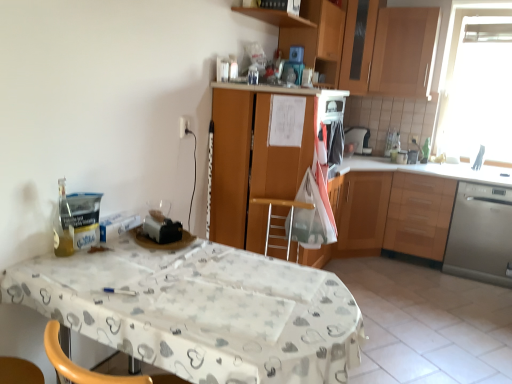
Question: Is wooden cabinet at upper right, which is the 2th cabinetry from right to left, not within wooden cabinet at right, which is the first cabinetry in right-to-left order?

Choices:
 (A) yes
 (B) no

Answer: (A)

Question: Is wooden cabinet at upper right, which is the 2th cabinetry from right to left, oriented away from wooden cabinet at right, the 4th cabinetry from the left?

Choices:
 (A) no
 (B) yes

Answer: (A)

Question: Is wooden cabinet at upper right, the 3th cabinetry positioned from the left, smaller than wooden cabinet at right, the 4th cabinetry from the left?

Choices:
 (A) no
 (B) yes

Answer: (B)

Question: Considering the relative sizes of wooden cabinet at upper right, which is the 2th cabinetry from right to left, and wooden cabinet at right, the 4th cabinetry from the left, in the image provided, is wooden cabinet at upper right, which is the 2th cabinetry from right to left, thinner than wooden cabinet at right, the 4th cabinetry from the left,?

Choices:
 (A) yes
 (B) no

Answer: (A)

Question: From a real-world perspective, is wooden cabinet at upper right, which is the 2th cabinetry from right to left, located higher than wooden cabinet at right, the 4th cabinetry from the left?

Choices:
 (A) no
 (B) yes

Answer: (B)

Question: In the image, is white fabric-covered table at center positioned in front of or behind wooden cabinet at center, which ranks as the fourth cabinetry in right-to-left order?

Choices:
 (A) behind
 (B) front

Answer: (B)

Question: From a real-world perspective, relative to wooden cabinet at center, which is counted as the first cabinetry, starting from the left, is white fabric-covered table at center vertically above or below?

Choices:
 (A) below
 (B) above

Answer: (A)

Question: Considering the positions of white fabric-covered table at center and wooden cabinet at center, which ranks as the fourth cabinetry in right-to-left order, in the image, is white fabric-covered table at center wider or thinner than wooden cabinet at center, which ranks as the fourth cabinetry in right-to-left order,?

Choices:
 (A) thin
 (B) wide

Answer: (B)

Question: Does point (352, 309) appear closer or farther from the camera than point (229, 221)?

Choices:
 (A) closer
 (B) farther

Answer: (A)

Question: Considering their positions, is wooden cabinet at upper center, marked as the 2th cabinetry in a left-to-right arrangement, located in front of or behind wooden cabinet at center, which is counted as the first cabinetry, starting from the left?

Choices:
 (A) behind
 (B) front

Answer: (A)

Question: From the image's perspective, is wooden cabinet at upper center, acting as the 3th cabinetry starting from the right, above or below wooden cabinet at center, which is counted as the first cabinetry, starting from the left?

Choices:
 (A) above
 (B) below

Answer: (A)

Question: In terms of size, does wooden cabinet at upper center, marked as the 2th cabinetry in a left-to-right arrangement, appear bigger or smaller than wooden cabinet at center, which ranks as the fourth cabinetry in right-to-left order?

Choices:
 (A) small
 (B) big

Answer: (A)

Question: Based on their positions, is wooden cabinet at upper center, marked as the 2th cabinetry in a left-to-right arrangement, located to the left or right of wooden cabinet at center, which is counted as the first cabinetry, starting from the left?

Choices:
 (A) left
 (B) right

Answer: (B)

Question: Considering the positions of white glossy sink at upper right and transparent glass window at upper right in the image, is white glossy sink at upper right taller or shorter than transparent glass window at upper right?

Choices:
 (A) short
 (B) tall

Answer: (A)

Question: Considering the positions of white glossy sink at upper right and transparent glass window at upper right in the image, is white glossy sink at upper right wider or thinner than transparent glass window at upper right?

Choices:
 (A) wide
 (B) thin

Answer: (B)